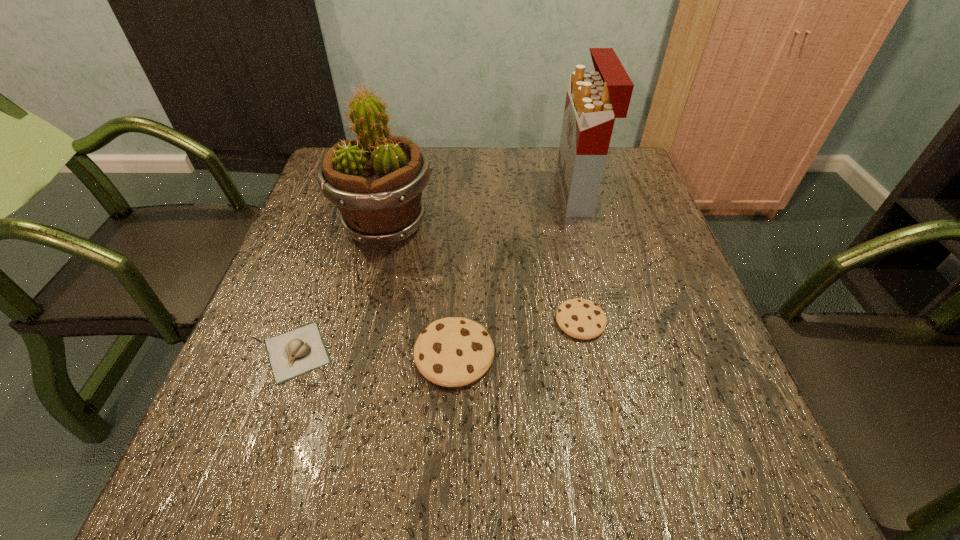
In the current image, all cookies are evenly spaced. To maintain this equal spacing, where should an additional cookie be placed on the right? Please point out a free spot. Please provide its 2D coordinates. Your answer should be formatted as a tuple, i.e. [(x, y)], where the tuple contains the x and y coordinates of a point satisfying the conditions above.

[(692, 292)]